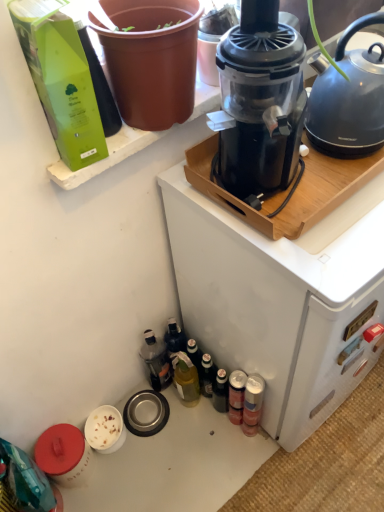
Question: Do you think black plastic coffee maker at upper center is within transparent plastic juicer at upper center, or outside of it?

Choices:
 (A) inside
 (B) outside

Answer: (B)

Question: Considering their positions, is black plastic coffee maker at upper center located in front of or behind transparent plastic juicer at upper center?

Choices:
 (A) front
 (B) behind

Answer: (B)

Question: Based on their relative distances, which object is farther from the green glass bottle at lower center, which is counted as the 3th bottle, starting from the right?

Choices:
 (A) brown matte flowerpot at upper left
 (B) transparent plastic juicer at upper center
 (C) metallic silver can at lower right, the 2th bottle in the right-to-left sequence
 (D) black plastic coffee maker at upper center
 (E) translucent plastic bottle at lower left, the 1th bottle in the left-to-right sequence

Answer: (A)

Question: Based on their relative distances, which object is farther from the matte gray kettle at upper right?

Choices:
 (A) translucent plastic bottle at lower left, the 1th bottle in the left-to-right sequence
 (B) brown matte flowerpot at upper left
 (C) transparent plastic juicer at upper center
 (D) metallic silver can at lower right, the 2th bottle in the right-to-left sequence
 (E) black plastic coffee maker at upper center

Answer: (A)